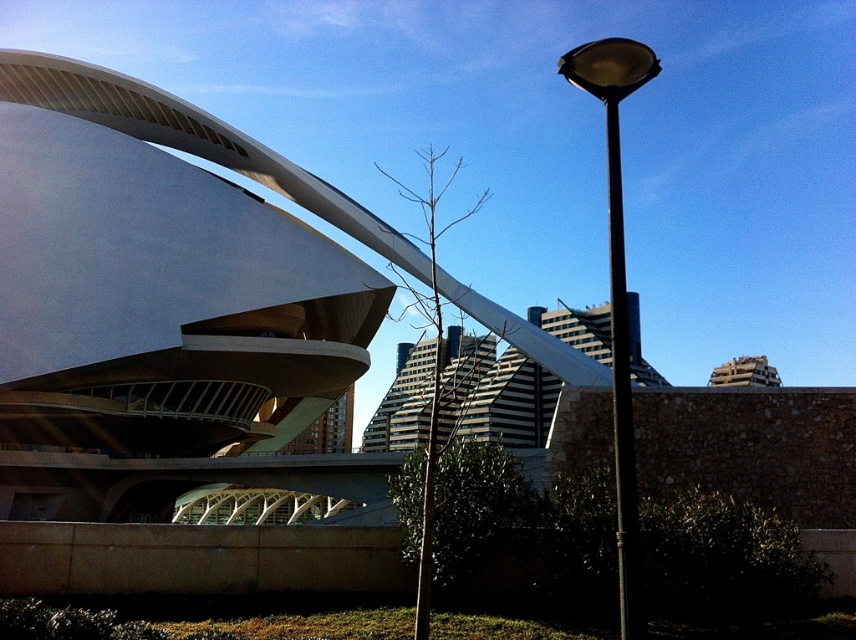
Who is more forward, (629, 540) or (609, 182)?

Point (629, 540) is in front.

Locate an element on the screen. black metal pole at upper right is located at coordinates (617, 291).